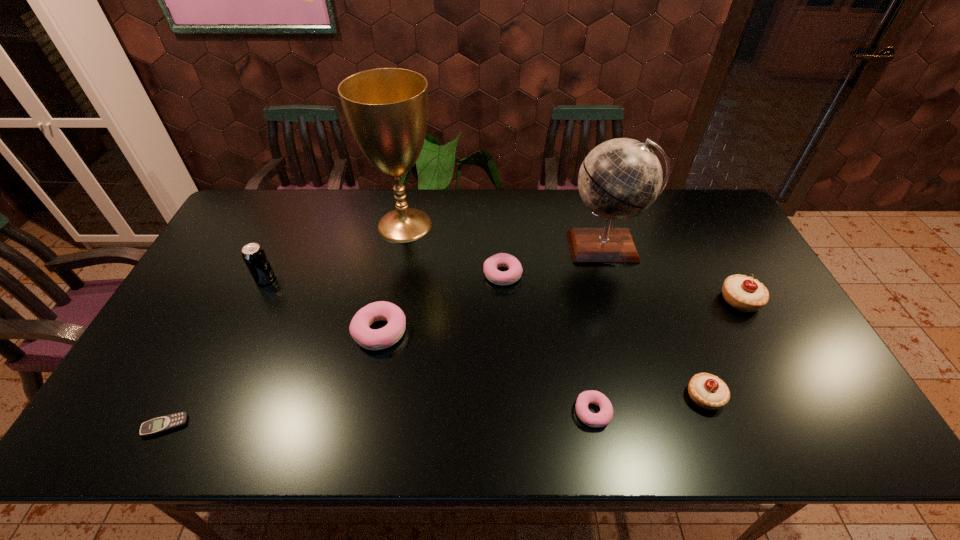
At what (x,y) coordinates should I click in order to perform the action: click on free space located 0.270m on the back of the leftmost pastry. Please return your answer as a coordinate pair (x, y). The image size is (960, 540). Looking at the image, I should click on (396, 246).

Locate an element on the screen. vacant region located 0.380m on the left of the farthest pink pastry is located at coordinates (359, 274).

Locate an element on the screen. Image resolution: width=960 pixels, height=540 pixels. vacant space located on the left of the third pastry from right to left is located at coordinates (511, 412).

Locate an element on the screen. This screenshot has height=540, width=960. free location located 0.060m on the left of the gray beeper is located at coordinates (118, 426).

Identify the location of trophy cup situated at the far edge. The image size is (960, 540). (386, 109).

Locate an element on the screen. The height and width of the screenshot is (540, 960). globe situated at the far edge is located at coordinates (621, 178).

Find the location of a particular element. The width and height of the screenshot is (960, 540). beeper at the near edge is located at coordinates (166, 423).

Find the location of a particular element. The height and width of the screenshot is (540, 960). object present at the left edge is located at coordinates (166, 423).

Locate an element on the screen. object present at the right edge is located at coordinates (743, 293).

Find the location of a particular element. object located in the near left corner section of the desktop is located at coordinates (166, 423).